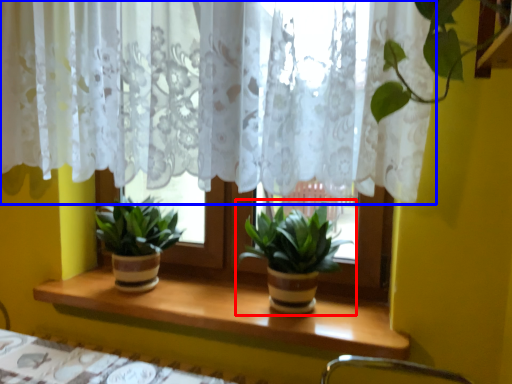
Question: Among these objects, which one is farthest to the camera, houseplant (highlighted by a red box) or curtain (highlighted by a blue box)?

Choices:
 (A) houseplant
 (B) curtain

Answer: (A)